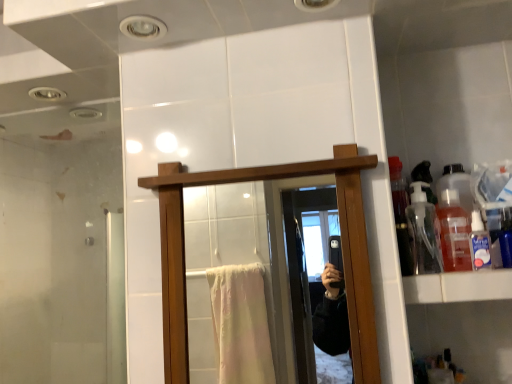
Question: Would you say clear plastic bottle at upper right is outside white glossy cabinet at right?

Choices:
 (A) no
 (B) yes

Answer: (B)

Question: Considering the relative positions of clear plastic bottle at upper right and white glossy cabinet at right in the image provided, is clear plastic bottle at upper right to the right of white glossy cabinet at right from the viewer's perspective?

Choices:
 (A) yes
 (B) no

Answer: (A)

Question: Does clear plastic bottle at upper right have a larger size compared to white glossy cabinet at right?

Choices:
 (A) no
 (B) yes

Answer: (A)

Question: Does clear plastic bottle at upper right come behind white glossy cabinet at right?

Choices:
 (A) yes
 (B) no

Answer: (A)

Question: Can you confirm if clear plastic bottle at upper right is shorter than white glossy cabinet at right?

Choices:
 (A) yes
 (B) no

Answer: (B)

Question: Does clear plastic bottle at upper right have a greater height compared to white glossy cabinet at right?

Choices:
 (A) no
 (B) yes

Answer: (B)

Question: Does transparent plastic bottle at upper right, the 2th bottle viewed from the right, have a larger size compared to translucent plastic bottle at upper right, arranged as the 2th bottle when viewed from the left?

Choices:
 (A) no
 (B) yes

Answer: (B)

Question: From a real-world perspective, is transparent plastic bottle at upper right, the 1th bottle viewed from the left, beneath translucent plastic bottle at upper right, the first bottle in the right-to-left sequence?

Choices:
 (A) no
 (B) yes

Answer: (A)

Question: Is transparent plastic bottle at upper right, the 1th bottle viewed from the left, shorter than translucent plastic bottle at upper right, arranged as the 2th bottle when viewed from the left?

Choices:
 (A) yes
 (B) no

Answer: (B)

Question: Can you confirm if transparent plastic bottle at upper right, the 1th bottle viewed from the left, is thinner than translucent plastic bottle at upper right, the first bottle in the right-to-left sequence?

Choices:
 (A) yes
 (B) no

Answer: (B)

Question: From a real-world perspective, is transparent plastic bottle at upper right, the 2th bottle viewed from the right, located higher than translucent plastic bottle at upper right, the first bottle in the right-to-left sequence?

Choices:
 (A) yes
 (B) no

Answer: (A)

Question: Is transparent plastic bottle at upper right, the 1th bottle viewed from the left, positioned far away from translucent plastic bottle at upper right, arranged as the 2th bottle when viewed from the left?

Choices:
 (A) yes
 (B) no

Answer: (B)

Question: Does clear plastic bottle at upper right have a larger size compared to translucent plastic bottle at upper right, arranged as the 2th bottle when viewed from the left?

Choices:
 (A) no
 (B) yes

Answer: (A)